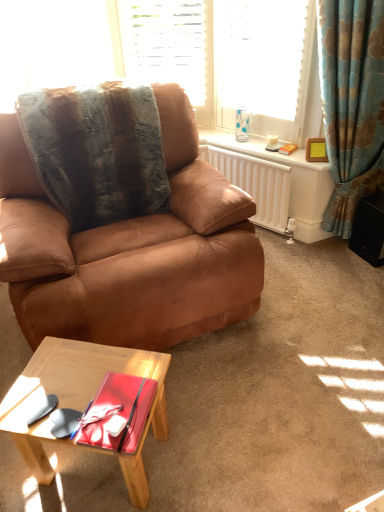
Question: Considering the positions of brown leather chair at center and white textured blinds at upper center, which is the second window from right to left, in the image, is brown leather chair at center bigger or smaller than white textured blinds at upper center, which is the second window from right to left,?

Choices:
 (A) small
 (B) big

Answer: (B)

Question: In the image, is brown leather chair at center on the left side or the right side of white textured blinds at upper center, which is the second window from right to left?

Choices:
 (A) right
 (B) left

Answer: (B)

Question: Considering the real-world distances, which object is closest to the translucent glass coffee cup at upper right?

Choices:
 (A) blue floral fabric curtain at right
 (B) white matte radiator at upper right
 (C) glassy blue curtain at upper right, which appears as the second window when viewed from the left
 (D) white textured blinds at upper center, which is the second window from right to left
 (E) light wood coffee table at lower left

Answer: (B)

Question: Considering the real-world distances, which object is closest to the glassy blue curtain at upper right, the first window positioned from the right?

Choices:
 (A) blue floral fabric curtain at right
 (B) brown leather chair at center
 (C) white matte radiator at upper right
 (D) wooden picture frame at upper right
 (E) light wood coffee table at lower left

Answer: (A)